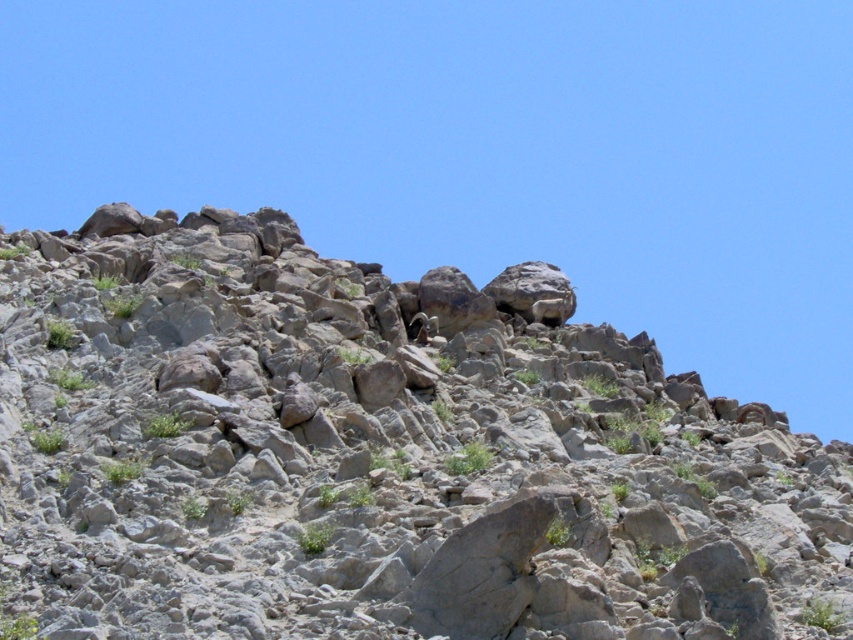
You are a hiker trying to climb the gray rocky mountain at upper center. You see the brown furry goat at center nearby. Which one is taller between the two?

The gray rocky mountain at upper center is taller than the brown furry goat at center.

You are a hiker trying to spot the brown furry goat at center from the base of the gray rocky mountain at upper center. Can you see the goat clearly from the mountain base?

The gray rocky mountain at upper center is positioned under the brown furry goat at center, so the goat is above the mountain base. Therefore, you can see the brown furry goat at center clearly from the mountain base as it is positioned above the rocks.